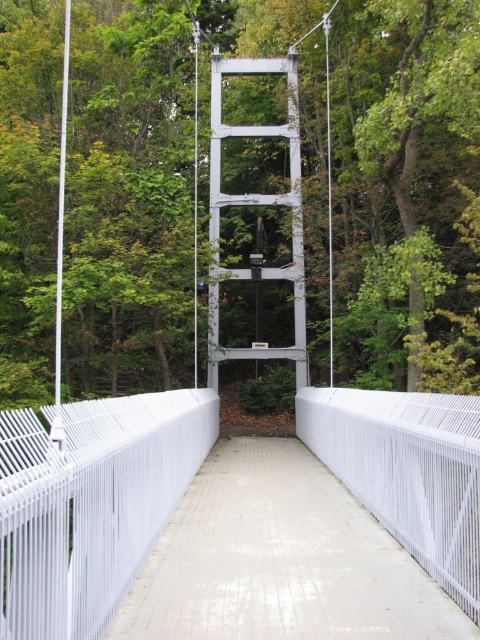
Is green leafy tree at center taller than white glossy concrete path at center?

Yes.

Is green leafy tree at center below white glossy concrete path at center?

No.

Describe the element at coordinates (275, 195) in the screenshot. I see `green leafy tree at center` at that location.

Find the location of `green leafy tree at center`. green leafy tree at center is located at coordinates (275, 195).